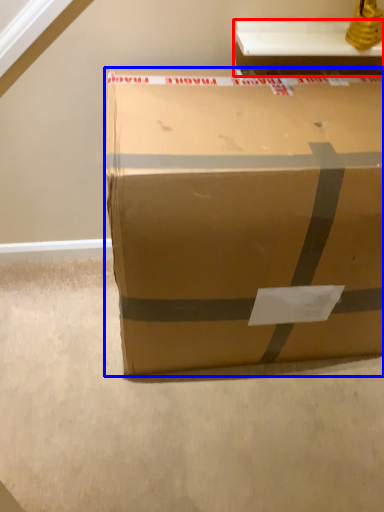
Question: Which object is closer to the camera taking this photo, table (highlighted by a red box) or box (highlighted by a blue box)?

Choices:
 (A) table
 (B) box

Answer: (B)